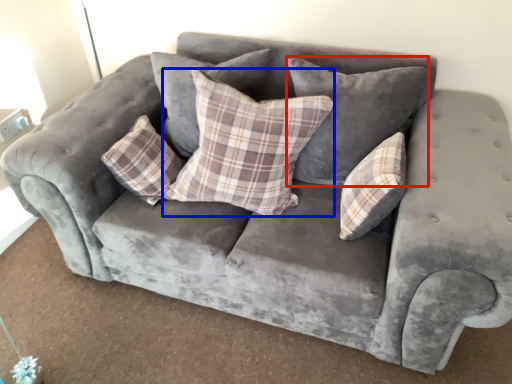
Question: Which object appears farthest to the camera in this image, pillow (highlighted by a red box) or pillow (highlighted by a blue box)?

Choices:
 (A) pillow
 (B) pillow

Answer: (A)